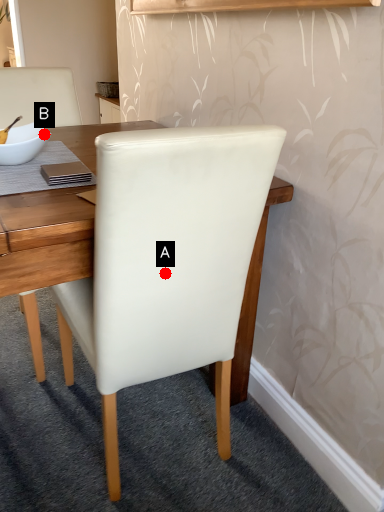
Question: Two points are circled on the image, labeled by A and B beside each circle. Which point is further to the camera?

Choices:
 (A) A is further
 (B) B is further

Answer: (B)